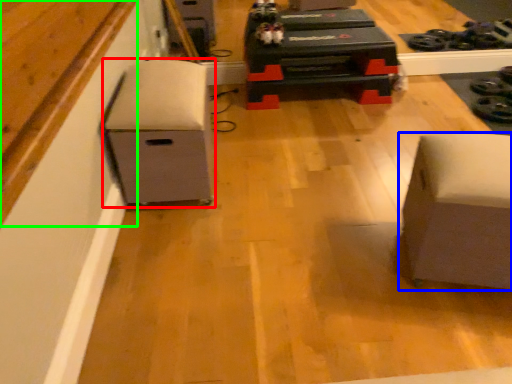
Question: Which object is positioned farthest from furniture (highlighted by a red box)? Select from furniture (highlighted by a blue box) and wood (highlighted by a green box).

Choices:
 (A) furniture
 (B) wood

Answer: (A)